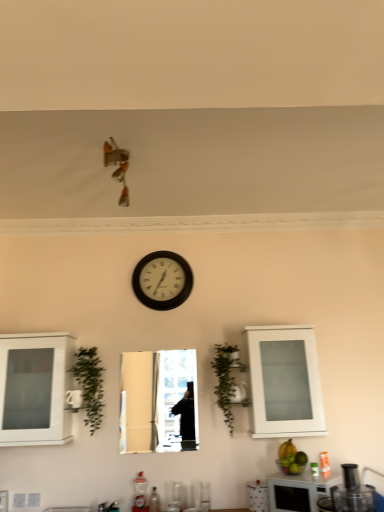
Question: Is metallic reflective mirror at center to the left of wooden wall clock at center from the viewer's perspective?

Choices:
 (A) no
 (B) yes

Answer: (B)

Question: Can you confirm if metallic reflective mirror at center is taller than wooden wall clock at center?

Choices:
 (A) yes
 (B) no

Answer: (A)

Question: From a real-world perspective, does metallic reflective mirror at center sit lower than wooden wall clock at center?

Choices:
 (A) yes
 (B) no

Answer: (A)

Question: Is metallic reflective mirror at center closer to the viewer compared to wooden wall clock at center?

Choices:
 (A) no
 (B) yes

Answer: (B)

Question: Is metallic reflective mirror at center oriented towards wooden wall clock at center?

Choices:
 (A) no
 (B) yes

Answer: (A)

Question: Does metallic reflective mirror at center have a lesser height compared to wooden wall clock at center?

Choices:
 (A) no
 (B) yes

Answer: (A)

Question: Can you confirm if green leafy plant at center, placed as the second plant when sorted from left to right, is positioned to the right of yellow matte bananas at lower right?

Choices:
 (A) yes
 (B) no

Answer: (B)

Question: From the image's perspective, is green leafy plant at center, placed as the second plant when sorted from left to right, over yellow matte bananas at lower right?

Choices:
 (A) no
 (B) yes

Answer: (B)

Question: Are green leafy plant at center, the first plant in the right-to-left sequence, and yellow matte bananas at lower right beside each other?

Choices:
 (A) yes
 (B) no

Answer: (B)

Question: Does green leafy plant at center, the first plant in the right-to-left sequence, have a larger size compared to yellow matte bananas at lower right?

Choices:
 (A) yes
 (B) no

Answer: (A)

Question: Considering the relative sizes of green leafy plant at center, the first plant in the right-to-left sequence, and yellow matte bananas at lower right in the image provided, is green leafy plant at center, the first plant in the right-to-left sequence, shorter than yellow matte bananas at lower right?

Choices:
 (A) no
 (B) yes

Answer: (A)

Question: Does green leafy plant at center, the first plant in the right-to-left sequence, lie in front of yellow matte bananas at lower right?

Choices:
 (A) no
 (B) yes

Answer: (A)

Question: Can you confirm if white matte cabinet at left, the 2th cabinetry when ordered from right to left, is taller than green leafy plant at center, placed as the second plant when sorted from left to right?

Choices:
 (A) yes
 (B) no

Answer: (A)